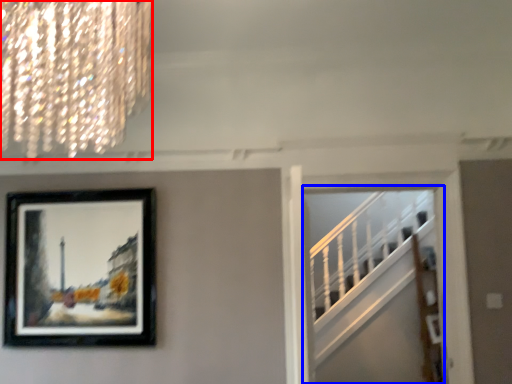
Question: Which of the following is the closest to the observer, lamp (highlighted by a red box) or escalator (highlighted by a blue box)?

Choices:
 (A) lamp
 (B) escalator

Answer: (A)